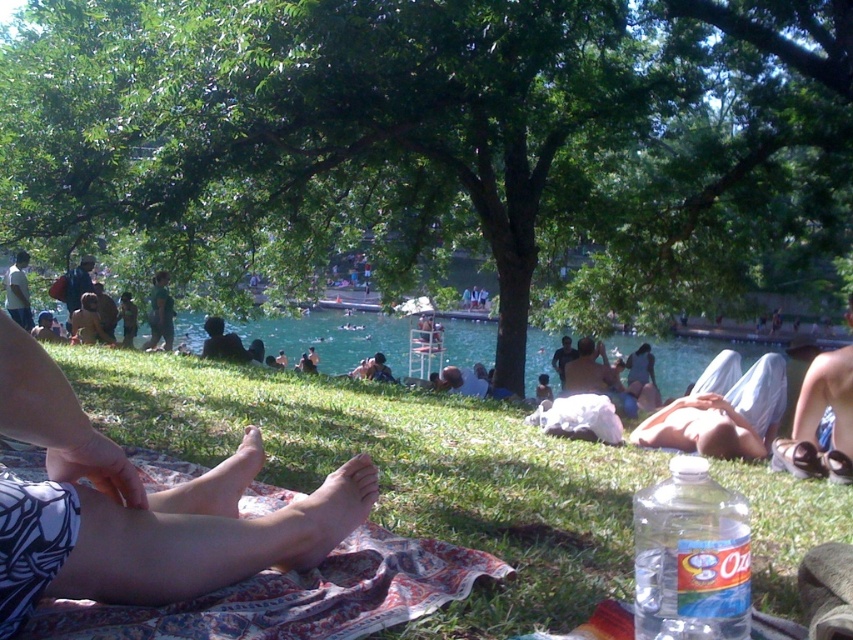
You are a photographer trying to capture the best shot of the skinny white legs at lower left. According to the coordinates provided, where should you position your camera relative to the image frame?

The skinny white legs at lower left are located at coordinates point [138,508], so you should position your camera to focus on that specific point within the image frame.

Consider the image. You are a photographer standing at the edge of the park, and you want to take a photo of the skinny white legs at lower left and the brown leather jacket at lower left. However, you need to ensure that both subjects are in focus. Given that your camera can only maintain focus within a 10 meter range, will you be able to capture both subjects clearly in the same photo?

The skinny white legs at lower left is 11.57 meters from the brown leather jacket at lower left. Since the distance between them exceeds the camera focus range of 10 meters, you cannot capture both subjects clearly in the same photo.